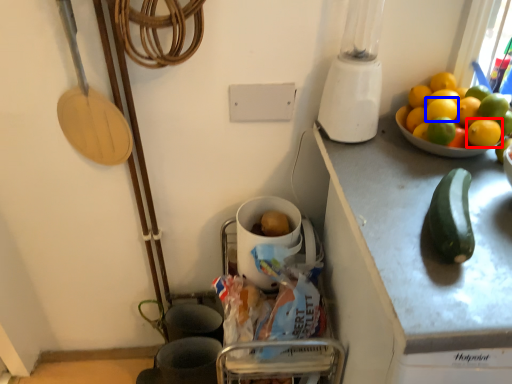
Question: Which of the following is the closest to the observer, lemon (highlighted by a red box) or lemon (highlighted by a blue box)?

Choices:
 (A) lemon
 (B) lemon

Answer: (A)